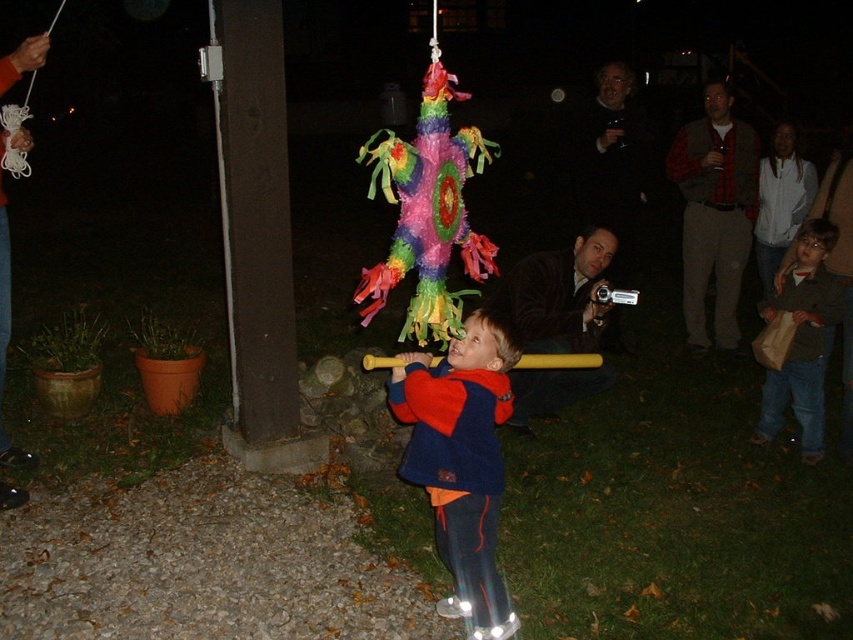
Looking at this image, between red plaid shirt at upper right and white fleece jacket at upper right, which one has more height?

With more height is red plaid shirt at upper right.

Does red plaid shirt at upper right have a smaller size compared to white fleece jacket at upper right?

Incorrect, red plaid shirt at upper right is not smaller in size than white fleece jacket at upper right.

Find the location of `red plaid shirt at upper right`. red plaid shirt at upper right is located at coordinates (714, 212).

Identify the location of red plaid shirt at upper right. (714, 212).

Does red plaid shirt at upper right have a lesser width compared to dark brown leather jacket at center?

Incorrect, red plaid shirt at upper right's width is not less than dark brown leather jacket at center's.

Who is taller, red plaid shirt at upper right or dark brown leather jacket at center?

red plaid shirt at upper right

Who is more forward, (683,257) or (589,260)?

Positioned in front is point (589,260).

At what (x,y) coordinates should I click in order to perform the action: click on red plaid shirt at upper right. Please return your answer as a coordinate pair (x, y). The image size is (853, 640). Looking at the image, I should click on (714, 212).

How much distance is there between blue fleece jacket at center and brown paper bag at lower right?

blue fleece jacket at center is 2.45 meters from brown paper bag at lower right.

Can you confirm if blue fleece jacket at center is smaller than brown paper bag at lower right?

Incorrect, blue fleece jacket at center is not smaller in size than brown paper bag at lower right.

Who is more forward, (474, 547) or (804, 342)?

Positioned in front is point (474, 547).

The image size is (853, 640). Find the location of `blue fleece jacket at center`. blue fleece jacket at center is located at coordinates pyautogui.click(x=461, y=461).